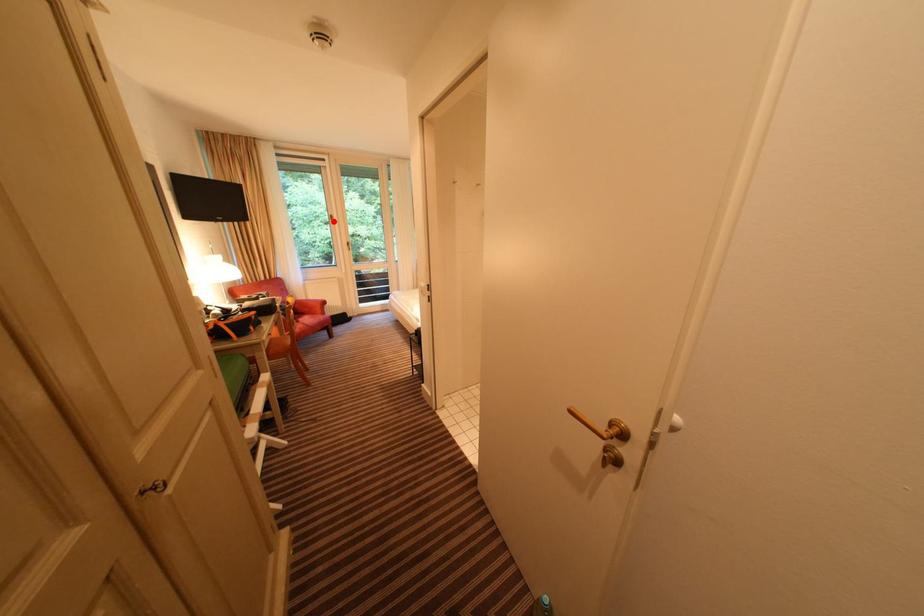
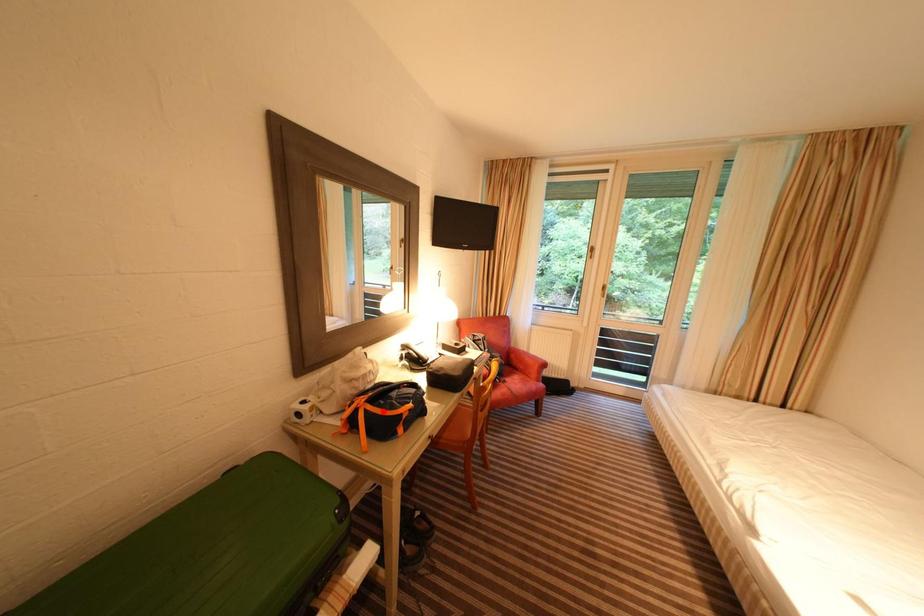
I am providing you with two images of the same scene from different viewpoints. A red point is marked on the first image and another point is marked on the second image. Are the points marked in image1 and image2 representing the same 3D position?

No